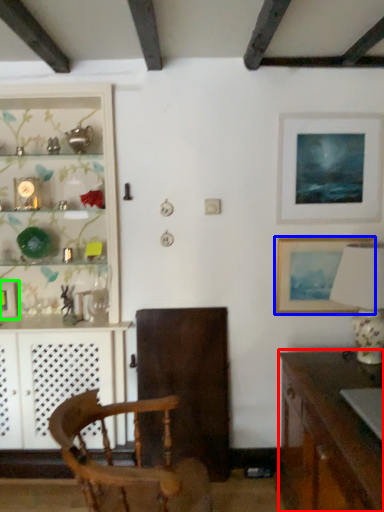
Question: Which object is the farthest from desk (highlighted by a red box)? Choose among these: picture frame (highlighted by a blue box) or picture frame (highlighted by a green box).

Choices:
 (A) picture frame
 (B) picture frame

Answer: (B)